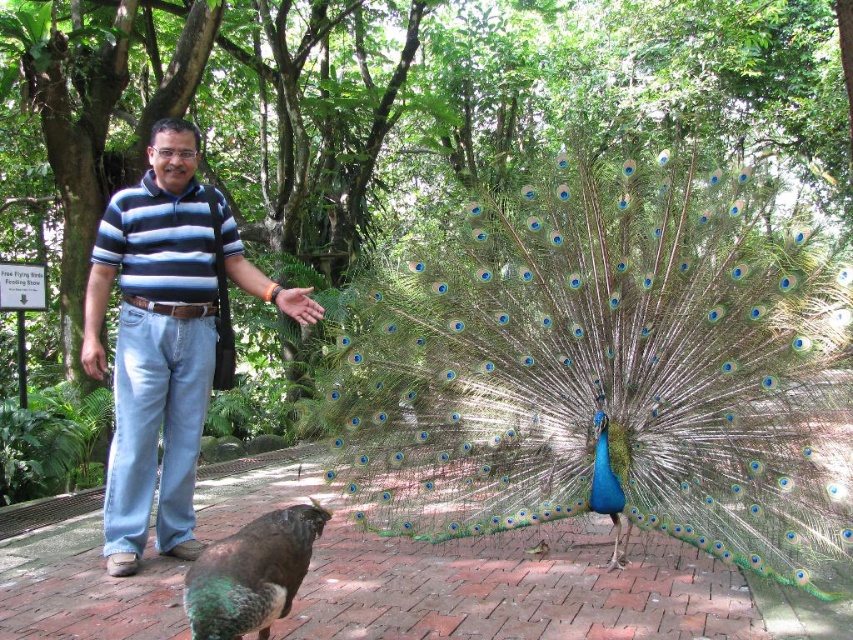
Question: Which point is closer to the camera taking this photo?

Choices:
 (A) (161, 394)
 (B) (163, 288)
 (C) (265, 579)

Answer: (C)

Question: Which point is farther to the camera?

Choices:
 (A) blue striped polo shirt at center
 (B) green iridescent feathers at lower left

Answer: (A)

Question: Does blue glossy peacock at center appear under blue striped polo shirt at center?

Choices:
 (A) yes
 (B) no

Answer: (A)

Question: Which object appears farthest from the camera in this image?

Choices:
 (A) blue glossy peacock at center
 (B) green iridescent feathers at lower left
 (C) blue striped shirt at center

Answer: (C)

Question: Is the position of blue striped polo shirt at center more distant than that of green iridescent feathers at lower left?

Choices:
 (A) yes
 (B) no

Answer: (A)

Question: In this image, where is blue striped shirt at center located relative to blue striped polo shirt at center?

Choices:
 (A) right
 (B) left

Answer: (A)